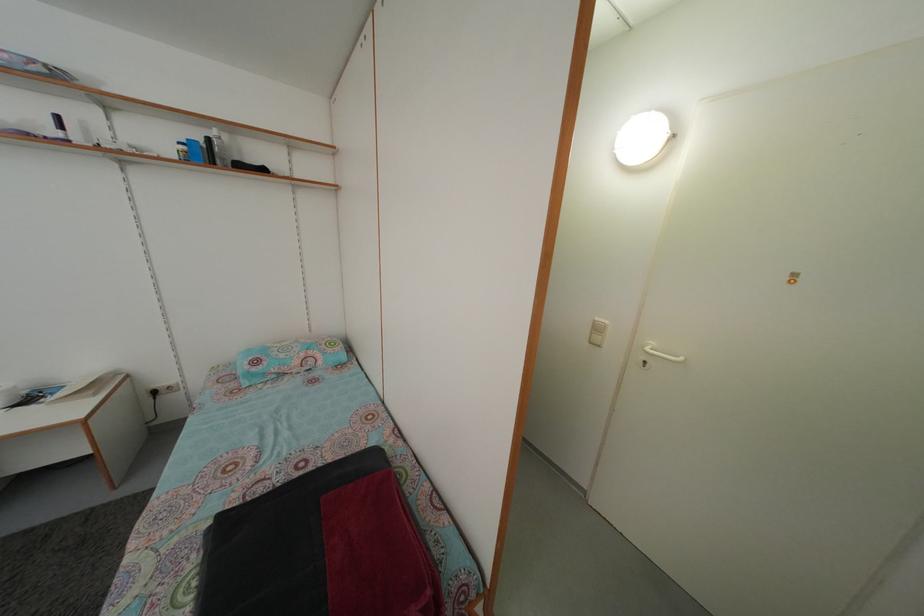
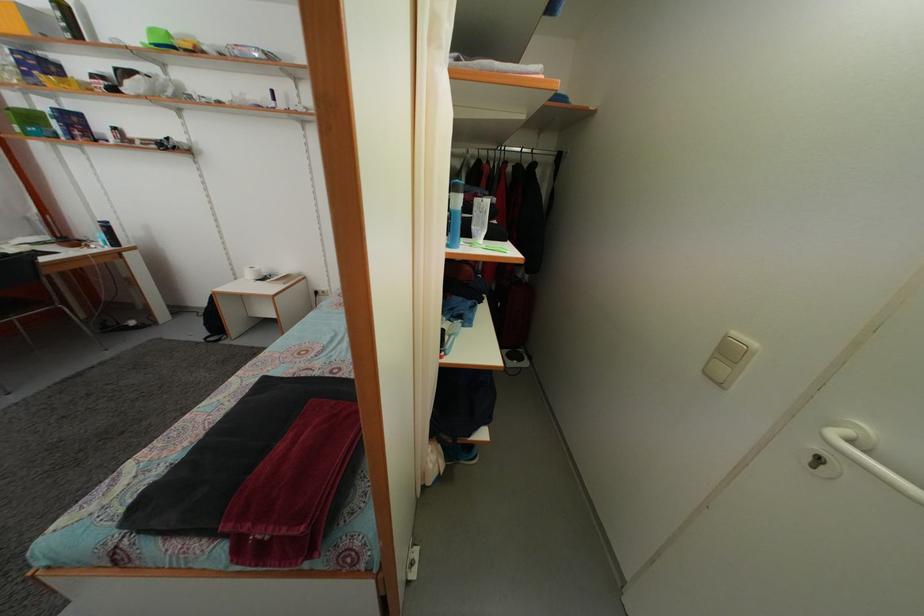
Question: The camera is either moving clockwise (left) or counter-clockwise (right) around the object. The first image is from the beginning of the video and the second image is from the end. Is the camera moving left or right when shooting the video?

Choices:
 (A) Left
 (B) Right

Answer: (B)